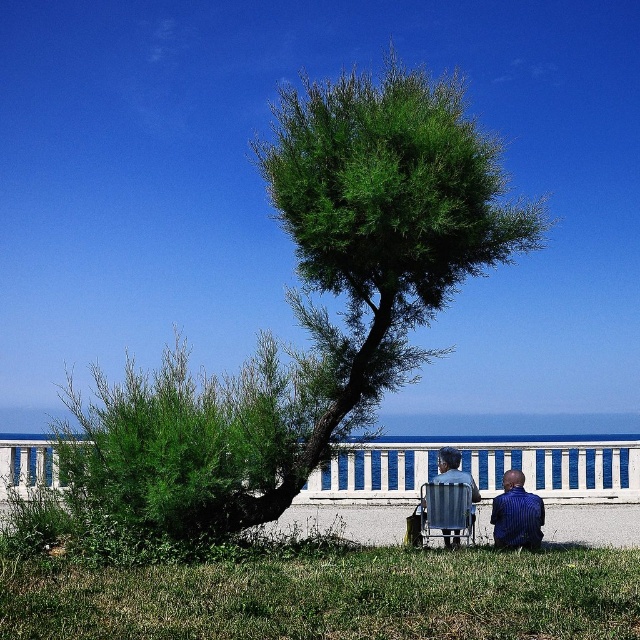
The image size is (640, 640). Describe the element at coordinates (516, 515) in the screenshot. I see `blue striped shirt at lower right` at that location.

Between point (506, 477) and point (451, 541), which one is positioned in front?

Point (451, 541)

What do you see at coordinates (516, 515) in the screenshot?
I see `blue striped shirt at lower right` at bounding box center [516, 515].

Where is `blue striped shirt at lower right`? blue striped shirt at lower right is located at coordinates (516, 515).

In the scene shown: Who is taller, green leafy tree at center or blue striped shirt at lower right?

With more height is blue striped shirt at lower right.

Can you confirm if green leafy tree at center is thinner than blue striped shirt at lower right?

Indeed, green leafy tree at center has a lesser width compared to blue striped shirt at lower right.

This screenshot has width=640, height=640. I want to click on green leafy tree at center, so [x=310, y=307].

I want to click on green leafy tree at center, so pyautogui.click(x=310, y=307).

Between point (358, 220) and point (424, 536), which one is positioned behind?

The point (424, 536) is behind.

Based on the photo, can you confirm if green leafy tree at center is positioned to the left of metallic silver beach chair at lower center?

Indeed, green leafy tree at center is positioned on the left side of metallic silver beach chair at lower center.

Find the location of a particular element. green leafy tree at center is located at coordinates (310, 307).